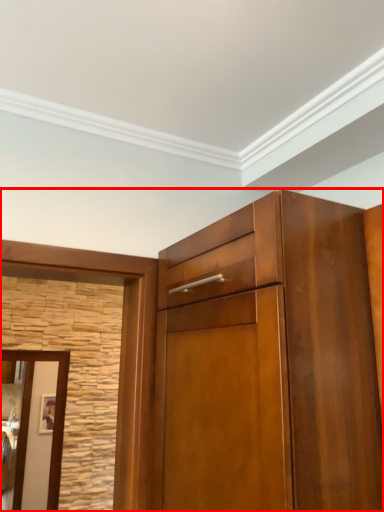
Question: From the image, what is the correct spatial relationship of cupboard (annotated by the red box) in relation to door?

Choices:
 (A) left
 (B) right

Answer: (B)